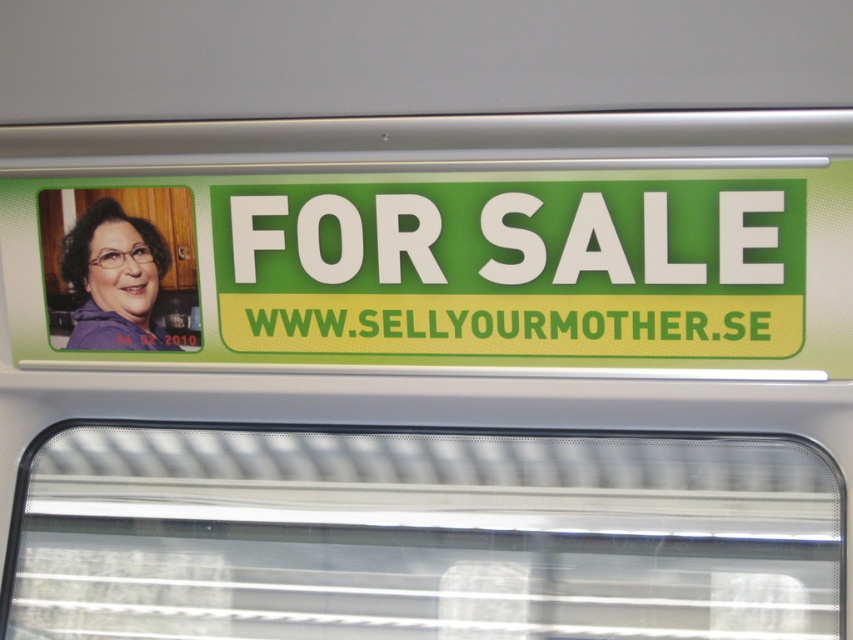
Which is behind, point (140, 493) or point (96, 342)?

The point (140, 493) is more distant.

Is point (770, 488) farther from viewer compared to point (137, 268)?

No, (770, 488) is in front of (137, 268).

Is point (194, 497) in front of point (112, 291)?

That is False.

Identify the location of transparent plastic window at center. (424, 536).

Is green/yellow plastic sign at center closer to camera compared to matte purple shirt at left?

Yes, green/yellow plastic sign at center is closer to the viewer.

Does green/yellow plastic sign at center come behind matte purple shirt at left?

No, green/yellow plastic sign at center is in front of matte purple shirt at left.

Is point (329, 337) closer to viewer compared to point (90, 321)?

Yes, it is in front of point (90, 321).

At what (x,y) coordinates should I click in order to perform the action: click on green/yellow plastic sign at center. Please return your answer as a coordinate pair (x, y). Image resolution: width=853 pixels, height=640 pixels. Looking at the image, I should click on (512, 268).

Is transparent plastic window at center positioned at the back of green/yellow plastic sign at center?

Yes, it is.

How far apart are transparent plastic window at center and green/yellow plastic sign at center?

A distance of 34.05 centimeters exists between transparent plastic window at center and green/yellow plastic sign at center.

Who is more forward, [45,492] or [225,288]?

Point [225,288] is more forward.

Locate an element on the screen. This screenshot has width=853, height=640. transparent plastic window at center is located at coordinates (424, 536).